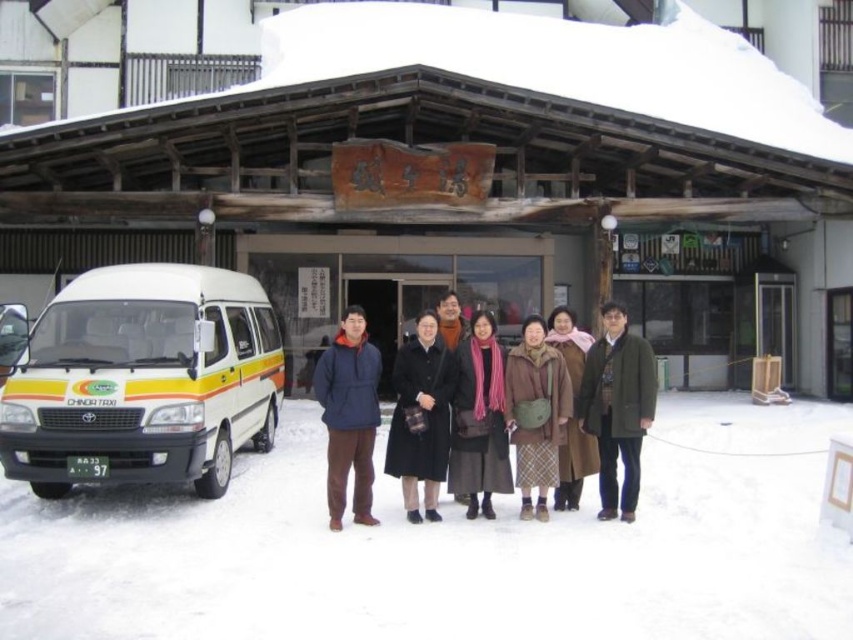
Does white powdery snow at lower center have a greater height compared to brown wool coat at center?

No, white powdery snow at lower center is not taller than brown wool coat at center.

Can you confirm if white powdery snow at lower center is positioned below brown wool coat at center?

Correct, white powdery snow at lower center is located below brown wool coat at center.

Does point (289, 541) come in front of point (535, 429)?

Yes, point (289, 541) is in front of point (535, 429).

Where is `white powdery snow at lower center`? white powdery snow at lower center is located at coordinates (450, 548).

Can you confirm if white glossy van at left is taller than dark blue jacket at center?

Indeed, white glossy van at left has a greater height compared to dark blue jacket at center.

Is white glossy van at left positioned behind dark blue jacket at center?

That is True.

Between point (206, 445) and point (328, 451), which one is positioned in front?

Point (206, 445) is more forward.

Locate an element on the screen. white glossy van at left is located at coordinates (143, 380).

Is point (357, 113) more distant than point (337, 440)?

Yes, it is behind point (337, 440).

The width and height of the screenshot is (853, 640). What do you see at coordinates (465, 173) in the screenshot? I see `wooden hut at center` at bounding box center [465, 173].

Where is `wooden hut at center`? This screenshot has width=853, height=640. wooden hut at center is located at coordinates (465, 173).